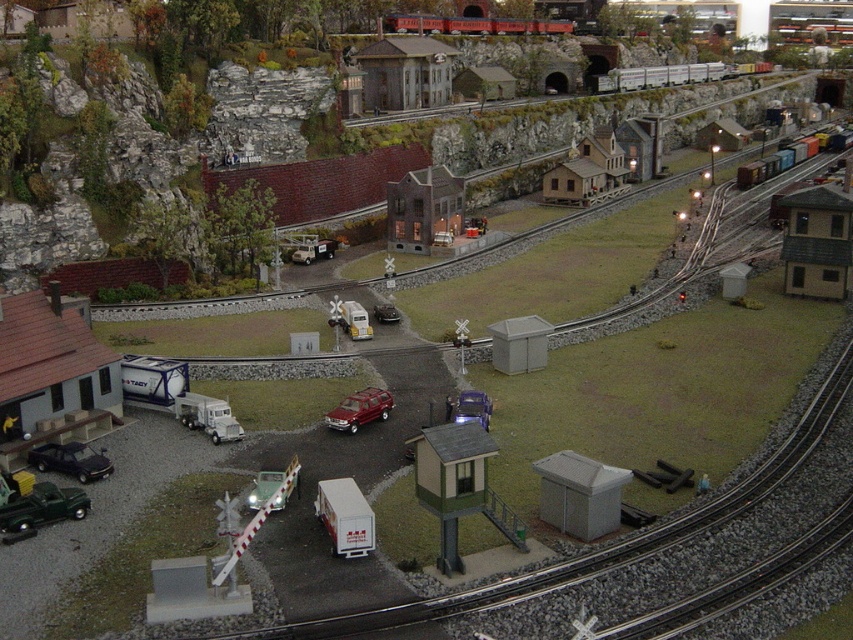
Is smooth asphalt train track at center below metallic silver truck at center?

No, smooth asphalt train track at center is not below metallic silver truck at center.

Is point (437, 602) positioned before point (265, 486)?

That is True.

Where is `smooth asphalt train track at center`? The height and width of the screenshot is (640, 853). smooth asphalt train track at center is located at coordinates (613, 544).

Is silver metallic train at upper right to the left of metal freight train at upper right from the viewer's perspective?

Indeed, silver metallic train at upper right is positioned on the left side of metal freight train at upper right.

Looking at this image, is silver metallic train at upper right bigger than metal freight train at upper right?

Correct, silver metallic train at upper right is larger in size than metal freight train at upper right.

Identify the location of silver metallic train at upper right. (662, 76).

Which is in front, point (358, 404) or point (258, 477)?

Point (258, 477) is in front.

Is point (383, 417) positioned behind point (263, 483)?

Yes, it is.

Does point (363, 400) lie in front of point (271, 486)?

No, it is behind (271, 486).

You are a GUI agent. You are given a task and a screenshot of the screen. Output one action in this format:
    pyautogui.click(x=<x>, y=<y>)
    Task: Click on the metallic red suv at center
    The image size is (853, 640).
    Given the screenshot: What is the action you would take?
    coord(358,410)